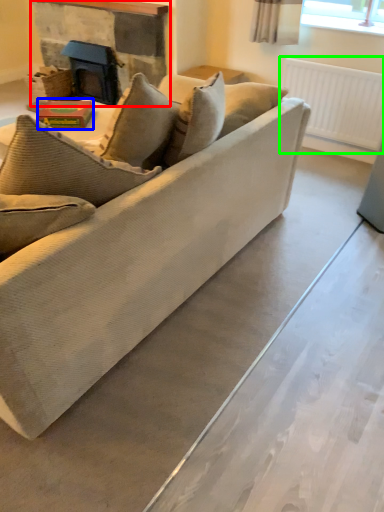
Question: Based on their relative distances, which object is farther from fireplace (highlighted by a red box)? Choose from book (highlighted by a blue box) and radiator (highlighted by a green box).

Choices:
 (A) book
 (B) radiator

Answer: (B)